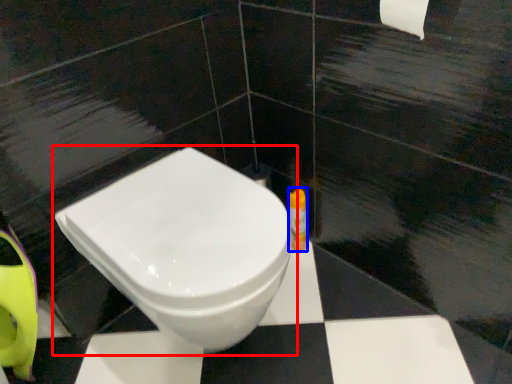
Question: Which of the following is the farthest to the observer, toilet (highlighted by a red box) or toiletry (highlighted by a blue box)?

Choices:
 (A) toilet
 (B) toiletry

Answer: (B)